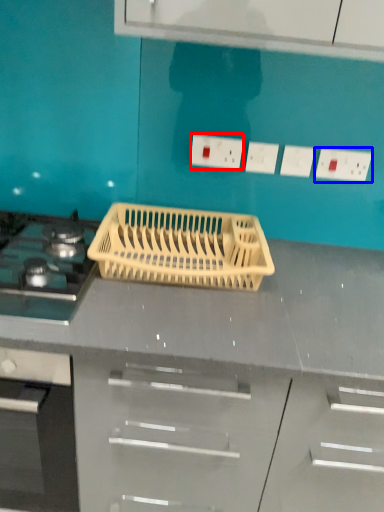
Question: Which of the following is the closest to the observer, electric outlet (highlighted by a red box) or electric outlet (highlighted by a blue box)?

Choices:
 (A) electric outlet
 (B) electric outlet

Answer: (B)